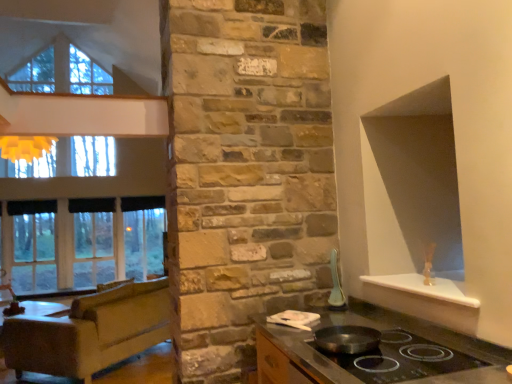
Question: Are black fabric curtain at left, which is the first curtain from right to left, and black fabric curtain at left, acting as the 1th curtain starting from the left, making contact?

Choices:
 (A) no
 (B) yes

Answer: (A)

Question: Does black fabric curtain at left, arranged as the 1th curtain when viewed from the back, have a greater height compared to black fabric curtain at left, which is counted as the 1th curtain, starting from the front?

Choices:
 (A) yes
 (B) no

Answer: (B)

Question: Does black fabric curtain at left, which is the first curtain from right to left, come in front of black fabric curtain at left, acting as the second curtain starting from the right?

Choices:
 (A) yes
 (B) no

Answer: (B)

Question: Can you confirm if black fabric curtain at left, the 2th curtain in the front-to-back sequence, is bigger than black fabric curtain at left, the 2th curtain viewed from the back?

Choices:
 (A) no
 (B) yes

Answer: (A)

Question: Is black fabric curtain at left, the second curtain when ordered from left to right, positioned behind black fabric curtain at left, acting as the 1th curtain starting from the left?

Choices:
 (A) yes
 (B) no

Answer: (A)

Question: Is black fabric curtain at left, the 2th curtain in the front-to-back sequence, to the right of black fabric curtain at left, the 2th curtain viewed from the back, from the viewer's perspective?

Choices:
 (A) no
 (B) yes

Answer: (B)

Question: From a real-world perspective, is black fabric curtain at left, which is the first curtain from right to left, located higher than brown leather couch at left?

Choices:
 (A) no
 (B) yes

Answer: (B)

Question: Does black fabric curtain at left, the second curtain when ordered from left to right, have a larger size compared to brown leather couch at left?

Choices:
 (A) yes
 (B) no

Answer: (B)

Question: Is black fabric curtain at left, arranged as the 1th curtain when viewed from the back, positioned with its back to brown leather couch at left?

Choices:
 (A) no
 (B) yes

Answer: (A)

Question: Is black fabric curtain at left, which is the first curtain from right to left, smaller than brown leather couch at left?

Choices:
 (A) yes
 (B) no

Answer: (A)

Question: From a real-world perspective, does black fabric curtain at left, arranged as the 1th curtain when viewed from the back, sit lower than brown leather couch at left?

Choices:
 (A) no
 (B) yes

Answer: (A)

Question: Is black fabric curtain at left, which is the first curtain from right to left, completely or partially outside of brown leather couch at left?

Choices:
 (A) no
 (B) yes

Answer: (B)

Question: Does black fabric curtain at left, arranged as the 1th curtain when viewed from the back, have a smaller size compared to white glossy spoon at upper right?

Choices:
 (A) no
 (B) yes

Answer: (A)